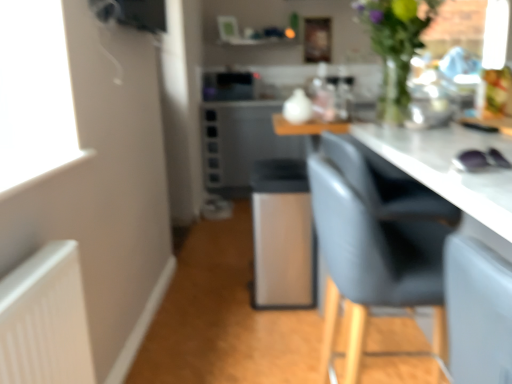
Question: From a real-world perspective, is green glass vase at upper right located beneath satin silver microwave at center?

Choices:
 (A) yes
 (B) no

Answer: (B)

Question: Is green glass vase at upper right bigger than satin silver microwave at center?

Choices:
 (A) yes
 (B) no

Answer: (A)

Question: Would you consider green glass vase at upper right to be distant from satin silver microwave at center?

Choices:
 (A) no
 (B) yes

Answer: (B)

Question: Is green glass vase at upper right completely or partially outside of satin silver microwave at center?

Choices:
 (A) yes
 (B) no

Answer: (A)

Question: Considering the relative positions of green glass vase at upper right and satin silver microwave at center in the image provided, is green glass vase at upper right to the left of satin silver microwave at center from the viewer's perspective?

Choices:
 (A) no
 (B) yes

Answer: (A)

Question: From a real-world perspective, is green glass vase at upper right physically above satin silver microwave at center?

Choices:
 (A) yes
 (B) no

Answer: (A)

Question: Is satin silver bar stool at center outside satin silver microwave at center?

Choices:
 (A) no
 (B) yes

Answer: (B)

Question: From a real-world perspective, is satin silver bar stool at center below satin silver microwave at center?

Choices:
 (A) yes
 (B) no

Answer: (A)

Question: Does satin silver bar stool at center come in front of satin silver microwave at center?

Choices:
 (A) yes
 (B) no

Answer: (A)

Question: From a real-world perspective, is satin silver bar stool at center over satin silver microwave at center?

Choices:
 (A) yes
 (B) no

Answer: (B)

Question: Is satin silver bar stool at center far away from satin silver microwave at center?

Choices:
 (A) no
 (B) yes

Answer: (B)

Question: Considering the relative sizes of satin silver bar stool at center and satin silver microwave at center in the image provided, is satin silver bar stool at center wider than satin silver microwave at center?

Choices:
 (A) yes
 (B) no

Answer: (A)

Question: From a real-world perspective, is satin silver microwave at center physically below satin silver bar stool at center?

Choices:
 (A) no
 (B) yes

Answer: (A)